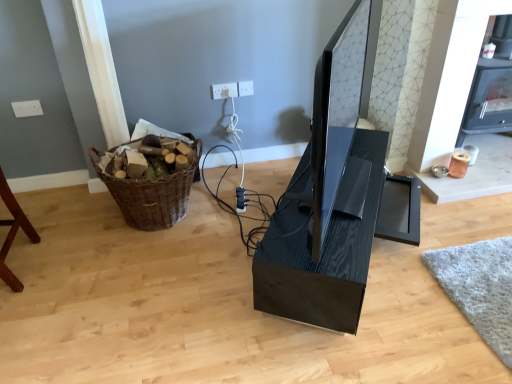
Where is `vacant space in front of woven brown basket at left`? Image resolution: width=512 pixels, height=384 pixels. vacant space in front of woven brown basket at left is located at coordinates (182, 263).